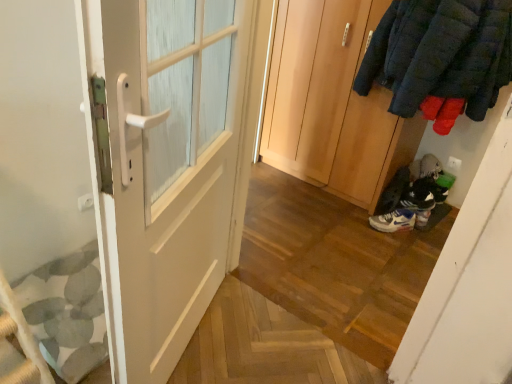
In order to face white matte sneaker at lower right, positioned as the 2th footwear in right-to-left order, should I rotate leftwards or rightwards?

A 18.009 degree turn to the right will do.

How much space does white leather sneakers at lower right, which appears as the second footwear when viewed from the left, occupy horizontally?

5.63 inches.

Find the location of a particular element. The width and height of the screenshot is (512, 384). white matte door at left, which is the 1th door in left-to-right order is located at coordinates (125, 170).

From the image's perspective, which is above, white matte sneaker at lower right, the first footwear viewed from the left, or white matte door at left, which is counted as the 2th door, starting from the right?

From the image's view, white matte door at left, which is counted as the 2th door, starting from the right, is above.

From the picture: Can you tell me how much white matte sneaker at lower right, positioned as the 2th footwear in right-to-left order, and white matte door at left, which is the 1th door in left-to-right order, differ in facing direction?

The facing directions of white matte sneaker at lower right, positioned as the 2th footwear in right-to-left order, and white matte door at left, which is the 1th door in left-to-right order, are 71 degrees apart.

From the picture: Which is closer, (391, 225) or (30, 45)?

Point (391, 225) is positioned farther from the camera compared to point (30, 45).

Where is `the 2nd door in front when counting from the white matte sneaker at lower right, positioned as the 2th footwear in right-to-left order`? the 2nd door in front when counting from the white matte sneaker at lower right, positioned as the 2th footwear in right-to-left order is located at coordinates (125, 170).

Based on their positions, is white matte sneaker at lower right, the first footwear viewed from the left, located to the left or right of white leather sneakers at lower right, which is the 1th footwear in right-to-left order?

From the image, it's evident that white matte sneaker at lower right, the first footwear viewed from the left, is to the left of white leather sneakers at lower right, which is the 1th footwear in right-to-left order.

Based on the photo, is white matte sneaker at lower right, positioned as the 2th footwear in right-to-left order, wider or thinner than white leather sneakers at lower right, which is the 1th footwear in right-to-left order?

Considering their sizes, white matte sneaker at lower right, positioned as the 2th footwear in right-to-left order, looks slimmer than white leather sneakers at lower right, which is the 1th footwear in right-to-left order.

Is white matte sneaker at lower right, positioned as the 2th footwear in right-to-left order, next to white leather sneakers at lower right, which is the 1th footwear in right-to-left order, and touching it?

They are not placed beside each other.

Is wooden wardrobe at center, the second door viewed from the front, at the back of white matte door at left, which ranks as the second door in back-to-front order?

white matte door at left, which ranks as the second door in back-to-front order, does not have its back to wooden wardrobe at center, the second door viewed from the front.

Consider the image. From the image's perspective, is white matte door at left, which is the 1th door in left-to-right order, above wooden wardrobe at center, the 1th door when ordered from right to left?

No, from the image's perspective, white matte door at left, which is the 1th door in left-to-right order, is not above wooden wardrobe at center, the 1th door when ordered from right to left.

Who is taller, white matte door at left, which is counted as the 2th door, starting from the right, or wooden wardrobe at center, arranged as the first door when viewed from the back?

With more height is white matte door at left, which is counted as the 2th door, starting from the right.

Would you say wooden wardrobe at center, the second door when ordered from left to right, is part of white matte door at left, which is the first door in front-to-back order,'s contents?

No, wooden wardrobe at center, the second door when ordered from left to right, is located outside of white matte door at left, which is the first door in front-to-back order.

Is white leather sneakers at lower right, which appears as the second footwear when viewed from the left, not within white matte door at left, which ranks as the second door in back-to-front order?

Yes.

In terms of height, does white leather sneakers at lower right, which is the 1th footwear in right-to-left order, look taller or shorter compared to white matte door at left, which is the first door in front-to-back order?

In the image, white leather sneakers at lower right, which is the 1th footwear in right-to-left order, appears to be shorter than white matte door at left, which is the first door in front-to-back order.

Consider the image. Is white leather sneakers at lower right, which is the 1th footwear in right-to-left order, at the right side of white matte door at left, which is counted as the 2th door, starting from the right?

Yes, white leather sneakers at lower right, which is the 1th footwear in right-to-left order, is to the right of white matte door at left, which is counted as the 2th door, starting from the right.

Can you tell me how much white leather sneakers at lower right, which is the 1th footwear in right-to-left order, and white matte door at left, which ranks as the second door in back-to-front order, differ in facing direction?

They differ by 111 degrees in their facing directions.

Is white matte door at left, which is counted as the 2th door, starting from the right, at the left side of white matte sneaker at lower right, positioned as the 2th footwear in right-to-left order?

Correct, you'll find white matte door at left, which is counted as the 2th door, starting from the right, to the left of white matte sneaker at lower right, positioned as the 2th footwear in right-to-left order.

Find the location of `the 1st footwear to the right when counting from the white matte door at left, which is the 1th door in left-to-right order`. the 1st footwear to the right when counting from the white matte door at left, which is the 1th door in left-to-right order is located at coordinates (393, 221).

From a real-world perspective, is white matte door at left, which is the 1th door in left-to-right order, positioned over white matte sneaker at lower right, positioned as the 2th footwear in right-to-left order, based on gravity?

Yes, from a real-world perspective, white matte door at left, which is the 1th door in left-to-right order, is over white matte sneaker at lower right, positioned as the 2th footwear in right-to-left order

Is white matte door at left, which ranks as the second door in back-to-front order, oriented away from white matte sneaker at lower right, positioned as the 2th footwear in right-to-left order?

No, white matte door at left, which ranks as the second door in back-to-front order, is not facing away from white matte sneaker at lower right, positioned as the 2th footwear in right-to-left order.

I want to click on the 2nd footwear to the right when counting from the white matte door at left, which is counted as the 2th door, starting from the right, so click(x=414, y=197).

From the picture: Is white matte door at left, which ranks as the second door in back-to-front order, aimed at white leather sneakers at lower right, which is the 1th footwear in right-to-left order?

No, white matte door at left, which ranks as the second door in back-to-front order, is not oriented towards white leather sneakers at lower right, which is the 1th footwear in right-to-left order.

Is white matte door at left, which is the 1th door in left-to-right order, positioned far away from white leather sneakers at lower right, which is the 1th footwear in right-to-left order?

Yes, white matte door at left, which is the 1th door in left-to-right order, is far from white leather sneakers at lower right, which is the 1th footwear in right-to-left order.

Does point (395, 205) come in front of point (355, 134)?

No, (395, 205) is further to viewer.

Considering the relative sizes of white leather sneakers at lower right, which is the 1th footwear in right-to-left order, and wooden wardrobe at center, the second door when ordered from left to right, in the image provided, is white leather sneakers at lower right, which is the 1th footwear in right-to-left order, bigger than wooden wardrobe at center, the second door when ordered from left to right,?

Actually, white leather sneakers at lower right, which is the 1th footwear in right-to-left order, might be smaller than wooden wardrobe at center, the second door when ordered from left to right.

From a real-world perspective, is white leather sneakers at lower right, which is the 1th footwear in right-to-left order, physically located above or below wooden wardrobe at center, the second door viewed from the front?

white leather sneakers at lower right, which is the 1th footwear in right-to-left order, is situated lower than wooden wardrobe at center, the second door viewed from the front, in the real world.

From the image's perspective, which one is positioned higher, white leather sneakers at lower right, which appears as the second footwear when viewed from the left, or wooden wardrobe at center, the second door when ordered from left to right?

wooden wardrobe at center, the second door when ordered from left to right, is shown above in the image.

In order to click on the 1st footwear to the right of the white matte door at left, which ranks as the second door in back-to-front order, starting your count from the anchor in this screenshot , I will do `click(393, 221)`.

Where is `footwear above the white matte sneaker at lower right, positioned as the 2th footwear in right-to-left order (from the image's perspective)`? The image size is (512, 384). footwear above the white matte sneaker at lower right, positioned as the 2th footwear in right-to-left order (from the image's perspective) is located at coordinates (414, 197).

Considering their positions, is white leather sneakers at lower right, which is the 1th footwear in right-to-left order, positioned further to wooden wardrobe at center, the 1th door when ordered from right to left, than white matte door at left, which is counted as the 2th door, starting from the right?

Among the two, white matte door at left, which is counted as the 2th door, starting from the right, is located further to wooden wardrobe at center, the 1th door when ordered from right to left.

Considering their positions, is white leather sneakers at lower right, which appears as the second footwear when viewed from the left, positioned further to white matte sneaker at lower right, the first footwear viewed from the left, than white matte door at left, which is counted as the 2th door, starting from the right?

Based on the image, white matte door at left, which is counted as the 2th door, starting from the right, appears to be further to white matte sneaker at lower right, the first footwear viewed from the left.

Considering their positions, is white matte door at left, which is counted as the 2th door, starting from the right, positioned further to white leather sneakers at lower right, which is the 1th footwear in right-to-left order, than wooden wardrobe at center, the second door when ordered from left to right?

white matte door at left, which is counted as the 2th door, starting from the right, lies further to white leather sneakers at lower right, which is the 1th footwear in right-to-left order, than the other object.

Estimate the real-world distances between objects in this image. Which object is further from wooden wardrobe at center, the second door viewed from the front, white leather sneakers at lower right, which appears as the second footwear when viewed from the left, or white matte sneaker at lower right, positioned as the 2th footwear in right-to-left order?

Among the two, white matte sneaker at lower right, positioned as the 2th footwear in right-to-left order, is located further to wooden wardrobe at center, the second door viewed from the front.

Based on their spatial positions, is wooden wardrobe at center, the second door when ordered from left to right, or white matte sneaker at lower right, the first footwear viewed from the left, further from white leather sneakers at lower right, which appears as the second footwear when viewed from the left?

Among the two, wooden wardrobe at center, the second door when ordered from left to right, is located further to white leather sneakers at lower right, which appears as the second footwear when viewed from the left.

Estimate the real-world distances between objects in this image. Which object is closer to white matte sneaker at lower right, positioned as the 2th footwear in right-to-left order, wooden wardrobe at center, the second door when ordered from left to right, or white matte door at left, which is the 1th door in left-to-right order?

wooden wardrobe at center, the second door when ordered from left to right.

Consider the image. Which object lies further to the anchor point white matte sneaker at lower right, the first footwear viewed from the left, white matte door at left, which is counted as the 2th door, starting from the right, or white leather sneakers at lower right, which is the 1th footwear in right-to-left order?

white matte door at left, which is counted as the 2th door, starting from the right.

Based on their spatial positions, is white matte sneaker at lower right, positioned as the 2th footwear in right-to-left order, or white matte door at left, which ranks as the second door in back-to-front order, further from wooden wardrobe at center, arranged as the first door when viewed from the back?

white matte door at left, which ranks as the second door in back-to-front order, is positioned further to the anchor wooden wardrobe at center, arranged as the first door when viewed from the back.

Find the location of a particular element. footwear between wooden wardrobe at center, the 1th door when ordered from right to left, and white matte sneaker at lower right, the first footwear viewed from the left, from top to bottom is located at coordinates (414, 197).

I want to click on door located between white matte door at left, which ranks as the second door in back-to-front order, and white matte sneaker at lower right, positioned as the 2th footwear in right-to-left order, in the depth direction, so click(332, 103).

This screenshot has height=384, width=512. What are the coordinates of `footwear between white matte door at left, which is counted as the 2th door, starting from the right, and white leather sneakers at lower right, which appears as the second footwear when viewed from the left, from front to back` in the screenshot? It's located at (393, 221).

The image size is (512, 384). Find the location of `door between white matte door at left, which is counted as the 2th door, starting from the right, and white leather sneakers at lower right, which appears as the second footwear when viewed from the left, in the front-back direction`. door between white matte door at left, which is counted as the 2th door, starting from the right, and white leather sneakers at lower right, which appears as the second footwear when viewed from the left, in the front-back direction is located at coordinates (332, 103).